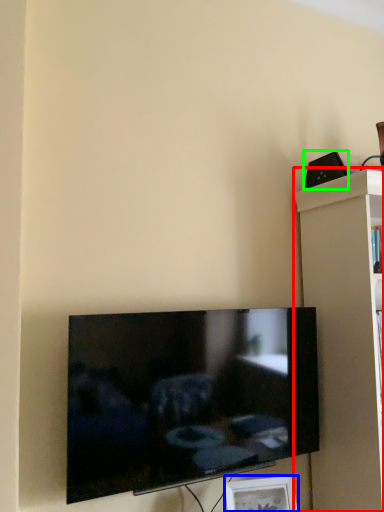
Question: Which object is positioned farthest from shelf (highlighted by a red box)? Select from picture frame (highlighted by a blue box) and speaker (highlighted by a green box).

Choices:
 (A) picture frame
 (B) speaker

Answer: (A)